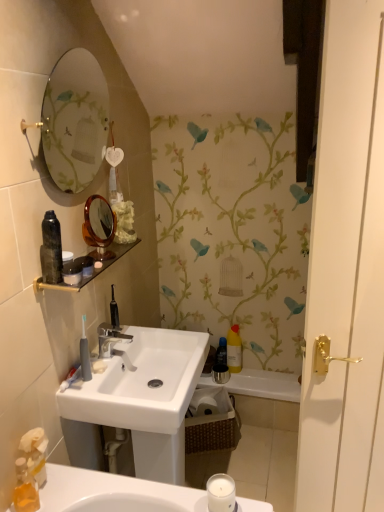
Locate an element on the screen. The image size is (384, 512). empty space that is ontop of white glossy bathtub at center (from a real-world perspective) is located at coordinates (254, 379).